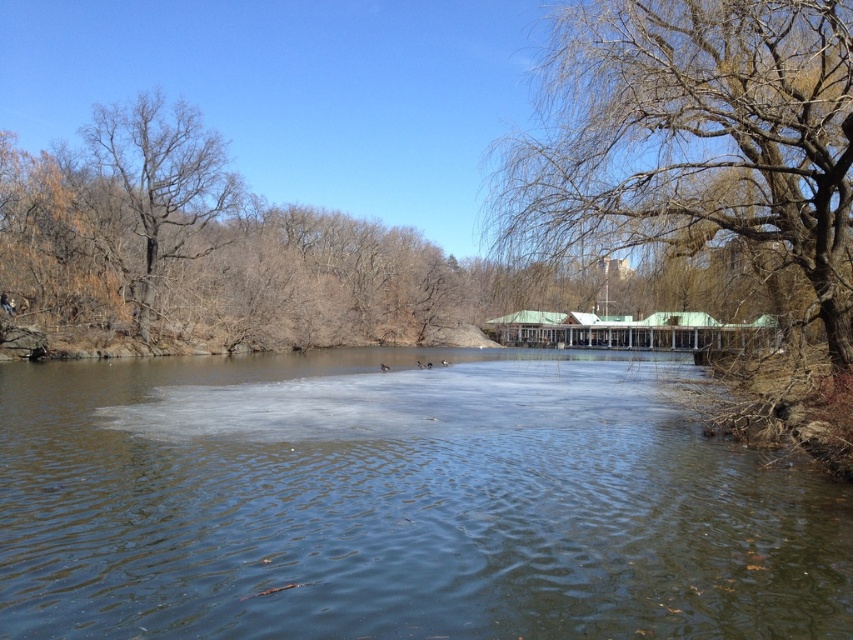
You are a park visitor who wants to walk across the frozen pond. You see the point marked at coordinates (399, 502). Is the area around that point safe to walk on?

The point (399, 502) corresponds to clear water at center, which is not frozen. Therefore, the area around that point is not safe to walk on.

You are a photographer trying to capture the clear water at center and the bare branches at upper right in the same frame. Which object will appear closer to the camera in the photo?

The clear water at center will appear closer to the camera because it is in front of the bare branches at upper right.

You are a photographer trying to capture the clear water at center and the bare branches at upper right in a single shot. Based on their positions, which object will appear closer to the top of your photo?

The bare branches at upper right will appear closer to the top of the photo because they are taller than the clear water at center.